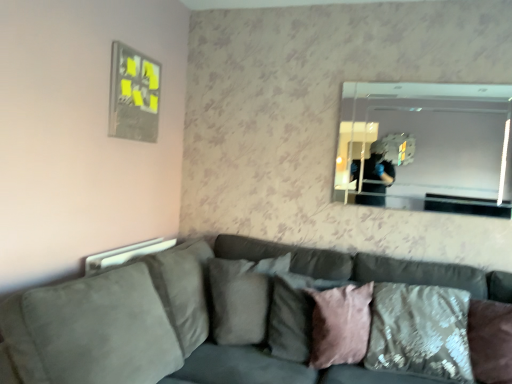
Question: Would you say suede-like gray pillow at center, arranged as the 4th pillow when viewed from the right, contains pink velvet pillow at center, placed as the 2th pillow when sorted from right to left?

Choices:
 (A) no
 (B) yes

Answer: (A)

Question: Does suede-like gray pillow at center, arranged as the 1th pillow when viewed from the left, come in front of pink velvet pillow at center, the 3th pillow from the left?

Choices:
 (A) no
 (B) yes

Answer: (A)

Question: Can you confirm if suede-like gray pillow at center, arranged as the 1th pillow when viewed from the left, is shorter than pink velvet pillow at center, the 3th pillow from the left?

Choices:
 (A) yes
 (B) no

Answer: (B)

Question: Would you consider suede-like gray pillow at center, arranged as the 1th pillow when viewed from the left, to be distant from pink velvet pillow at center, the 3th pillow from the left?

Choices:
 (A) yes
 (B) no

Answer: (B)

Question: Considering the relative sizes of suede-like gray pillow at center, arranged as the 1th pillow when viewed from the left, and pink velvet pillow at center, placed as the 2th pillow when sorted from right to left, in the image provided, is suede-like gray pillow at center, arranged as the 1th pillow when viewed from the left, bigger than pink velvet pillow at center, placed as the 2th pillow when sorted from right to left,?

Choices:
 (A) no
 (B) yes

Answer: (B)

Question: From the image's perspective, is suede-like gray pillow at center, arranged as the 4th pillow when viewed from the right, located above pink velvet pillow at center, placed as the 2th pillow when sorted from right to left?

Choices:
 (A) yes
 (B) no

Answer: (A)

Question: Is pink velvet pillow at center, the 3th pillow from the left, next to velvet textured pillow at lower right, the 4th pillow in the left-to-right sequence, and touching it?

Choices:
 (A) yes
 (B) no

Answer: (B)

Question: Is the depth of pink velvet pillow at center, placed as the 2th pillow when sorted from right to left, greater than that of velvet textured pillow at lower right, the 4th pillow in the left-to-right sequence?

Choices:
 (A) yes
 (B) no

Answer: (A)

Question: Considering the relative sizes of pink velvet pillow at center, placed as the 2th pillow when sorted from right to left, and velvet textured pillow at lower right, the 4th pillow in the left-to-right sequence, in the image provided, is pink velvet pillow at center, placed as the 2th pillow when sorted from right to left, wider than velvet textured pillow at lower right, the 4th pillow in the left-to-right sequence,?

Choices:
 (A) yes
 (B) no

Answer: (B)

Question: Is pink velvet pillow at center, the 3th pillow from the left, bigger than velvet textured pillow at lower right, the 4th pillow in the left-to-right sequence?

Choices:
 (A) yes
 (B) no

Answer: (B)

Question: Is pink velvet pillow at center, the 3th pillow from the left, facing towards velvet textured pillow at lower right, marked as the 1th pillow in a right-to-left arrangement?

Choices:
 (A) yes
 (B) no

Answer: (A)

Question: Considering the relative positions of pink velvet pillow at center, the 3th pillow from the left, and velvet textured pillow at lower right, marked as the 1th pillow in a right-to-left arrangement, in the image provided, is pink velvet pillow at center, the 3th pillow from the left, in front of velvet textured pillow at lower right, marked as the 1th pillow in a right-to-left arrangement,?

Choices:
 (A) no
 (B) yes

Answer: (A)

Question: Does velvet textured pillow at lower right, marked as the 1th pillow in a right-to-left arrangement, have a smaller size compared to pink velvet pillow at center, the 3th pillow from the left?

Choices:
 (A) no
 (B) yes

Answer: (A)